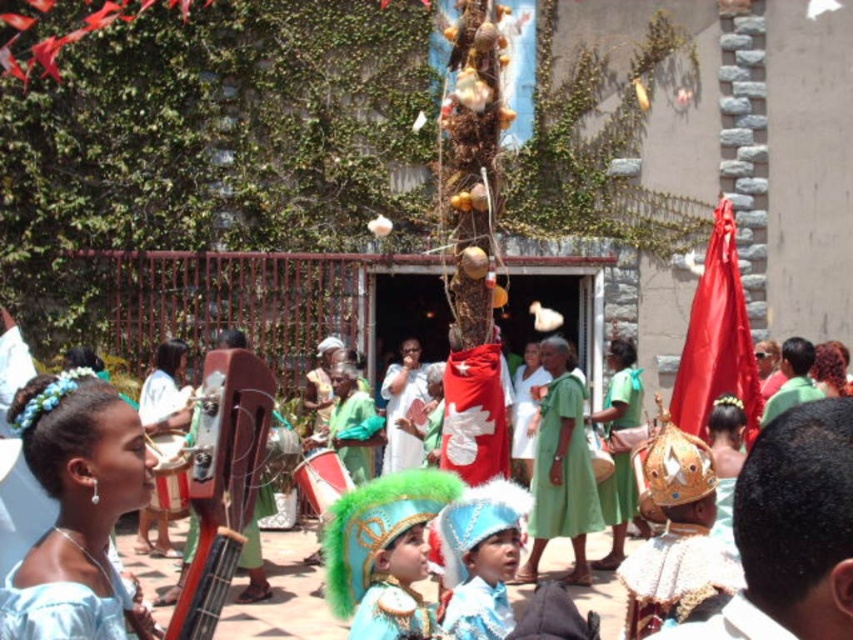
Where is `light blue satin dress at center`? This screenshot has width=853, height=640. light blue satin dress at center is located at coordinates (77, 509).

Is light blue satin dress at center taller than green cotton dress at center?

Yes.

Does point (94, 392) lie in front of point (548, 420)?

Yes, point (94, 392) is in front of point (548, 420).

Find the location of a particular element. light blue satin dress at center is located at coordinates (77, 509).

Between light blue satin dress at center and blue satin headdress at center, which one has less height?

blue satin headdress at center is shorter.

Which is in front, point (96, 429) or point (453, 624)?

Point (96, 429) is more forward.

Where is `light blue satin dress at center`? The height and width of the screenshot is (640, 853). light blue satin dress at center is located at coordinates 77,509.

Is shiny red drum at center thinner than blue satin headdress at center?

No.

Is shiny red drum at center wider than blue satin headdress at center?

Correct, the width of shiny red drum at center exceeds that of blue satin headdress at center.

Who is more distant from viewer, (x=55, y=508) or (x=451, y=616)?

Positioned behind is point (x=55, y=508).

You are a GUI agent. You are given a task and a screenshot of the screen. Output one action in this format:
    pyautogui.click(x=<x>, y=<y>)
    Task: Click on the shiny red drum at center
    Image resolution: width=853 pixels, height=640 pixels.
    Given the screenshot: What is the action you would take?
    pyautogui.click(x=282, y=596)